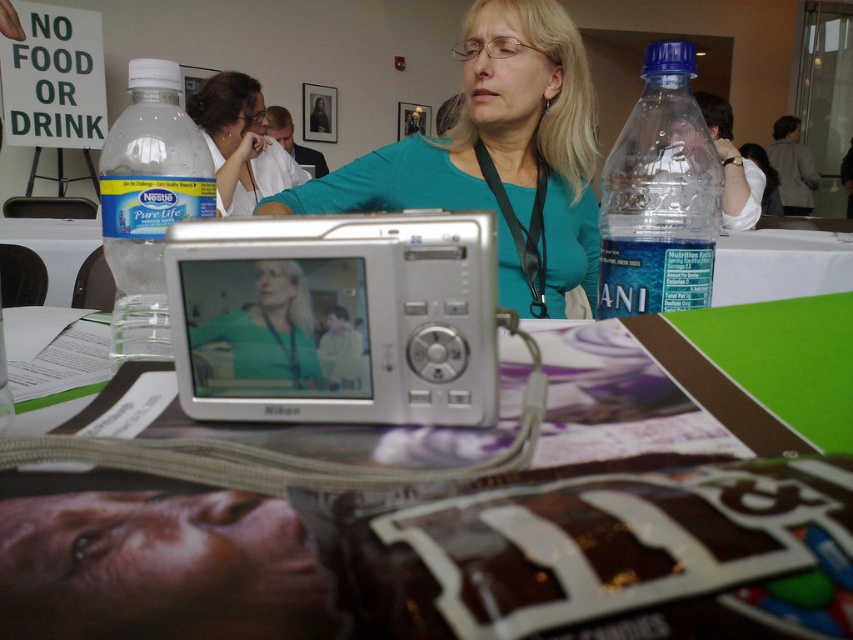
Does blue translucent bottle at upper right appear over blue translucent bottle at left?

Indeed, blue translucent bottle at upper right is positioned over blue translucent bottle at left.

Is the position of blue translucent bottle at upper right less distant than that of blue translucent bottle at left?

No.

Who is more forward, [630,136] or [125,113]?

Positioned in front is point [125,113].

In order to click on blue translucent bottle at upper right in this screenshot , I will do `click(659, 195)`.

Which is more to the left, teal fabric shirt at center or matte white shirt at upper center?

From the viewer's perspective, matte white shirt at upper center appears more on the left side.

Does teal fabric shirt at center have a lesser width compared to matte white shirt at upper center?

In fact, teal fabric shirt at center might be wider than matte white shirt at upper center.

Locate an element on the screen. teal fabric shirt at center is located at coordinates (498, 156).

This screenshot has width=853, height=640. In order to click on teal fabric shirt at center in this screenshot , I will do `click(498, 156)`.

Who is shorter, matte green shirt at center or matte white shirt at upper center?

Standing shorter between the two is matte green shirt at center.

Does matte green shirt at center lie behind matte white shirt at upper center?

No, matte green shirt at center is closer to the viewer.

In order to click on matte green shirt at center in this screenshot , I will do `click(260, 337)`.